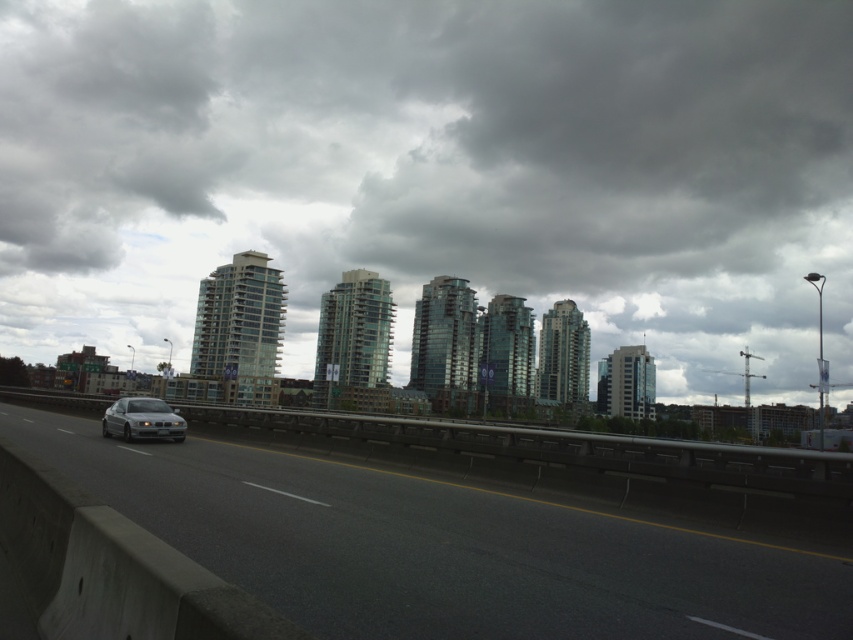
Question: Which of the following is the farthest from the observer?

Choices:
 (A) (149, 436)
 (B) (705, 563)

Answer: (A)

Question: Can you confirm if gray asphalt highway at center is wider than sleek silver sedan at left?

Choices:
 (A) no
 (B) yes

Answer: (B)

Question: Which point is farther to the camera?

Choices:
 (A) gray asphalt highway at center
 (B) sleek silver sedan at left

Answer: (B)

Question: Is gray asphalt highway at center closer to camera compared to sleek silver sedan at left?

Choices:
 (A) yes
 (B) no

Answer: (A)

Question: Is the position of gray asphalt highway at center more distant than that of sleek silver sedan at left?

Choices:
 (A) yes
 (B) no

Answer: (B)

Question: Which object is farther from the camera taking this photo?

Choices:
 (A) sleek silver sedan at left
 (B) gray asphalt highway at center

Answer: (A)